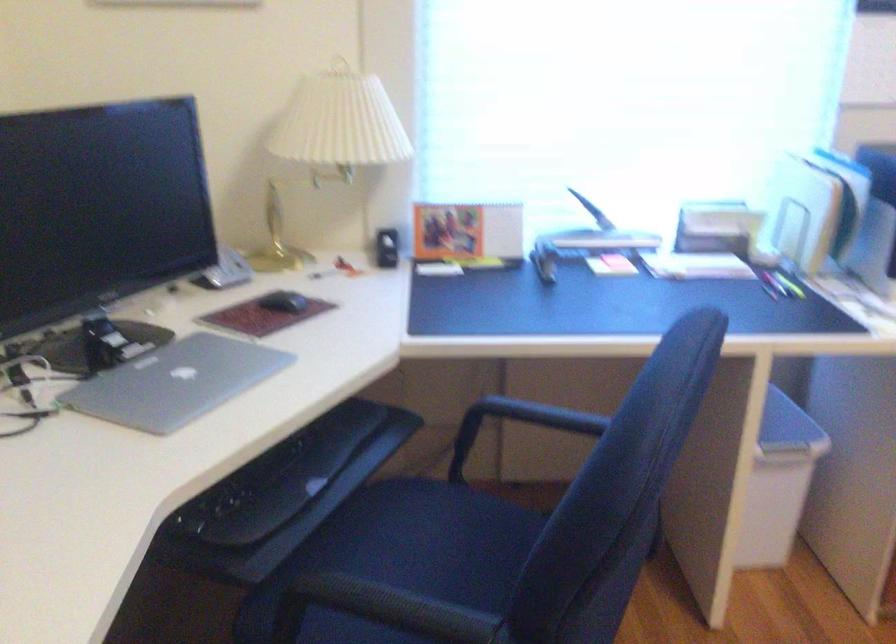
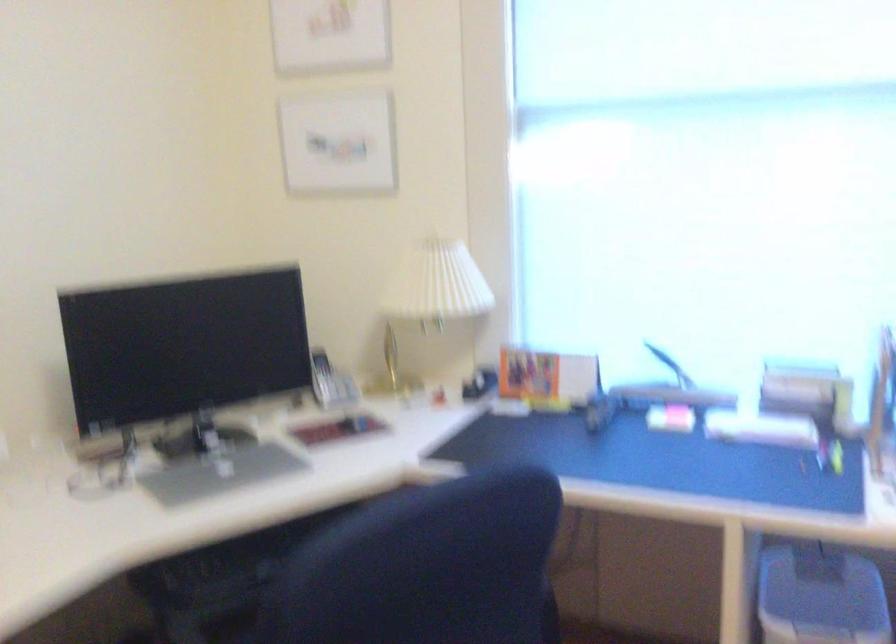
Question: The camera is either moving clockwise (left) or counter-clockwise (right) around the object. The first image is from the beginning of the video and the second image is from the end. Is the camera moving left or right when shooting the video?

Choices:
 (A) Left
 (B) Right

Answer: (B)